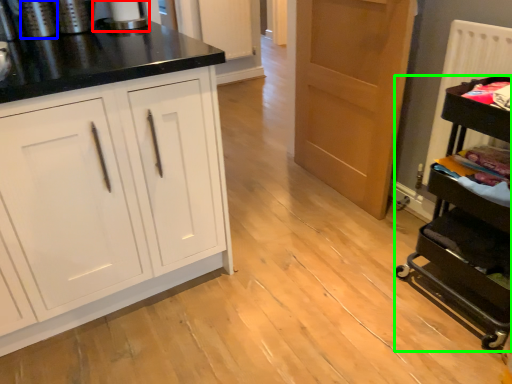
Question: Which is farther away from appliance (highlighted by a red box)? appliance (highlighted by a blue box) or appliance (highlighted by a green box)?

Choices:
 (A) appliance
 (B) appliance

Answer: (B)